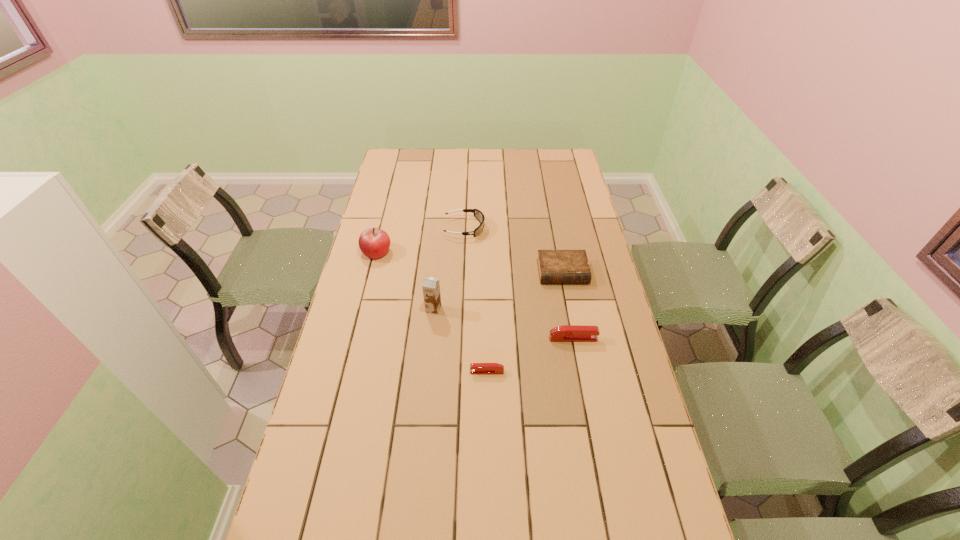
The image size is (960, 540). I want to click on free space between the diary and the farthest object, so click(x=514, y=250).

Find the location of a particular element. free space between the diary and the farthest object is located at coordinates (x=514, y=250).

At what (x,y) coordinates should I click in order to perform the action: click on empty space that is in between the third nearest object and the diary. Please return your answer as a coordinate pair (x, y). Image resolution: width=960 pixels, height=540 pixels. Looking at the image, I should click on (498, 291).

Image resolution: width=960 pixels, height=540 pixels. Identify the location of free point between the goggles and the farther stapler. (518, 284).

This screenshot has width=960, height=540. Find the location of `free space between the goggles and the tallest object`. free space between the goggles and the tallest object is located at coordinates (449, 268).

Locate an element on the screen. free area in between the nearest object and the diary is located at coordinates (525, 322).

Identify which object is located as the nearest to the fourth farthest object. Please provide its 2D coordinates. Your answer should be formatted as a tuple, i.e. [(x, y)], where the tuple contains the x and y coordinates of a point satisfying the conditions above.

[(475, 368)]

Select which object appears as the closest to the farther stapler. Please provide its 2D coordinates. Your answer should be formatted as a tuple, i.e. [(x, y)], where the tuple contains the x and y coordinates of a point satisfying the conditions above.

[(475, 368)]

What are the coordinates of `vacant region that satisfies the following two spatial constraints: 1. on the spine side of the diary; 2. on the front-facing side of the farther stapler` in the screenshot? It's located at (575, 339).

Identify the location of free space that satisfies the following two spatial constraints: 1. on the front side of the chocolate milk; 2. on the left side of the leftmost object. point(362,309).